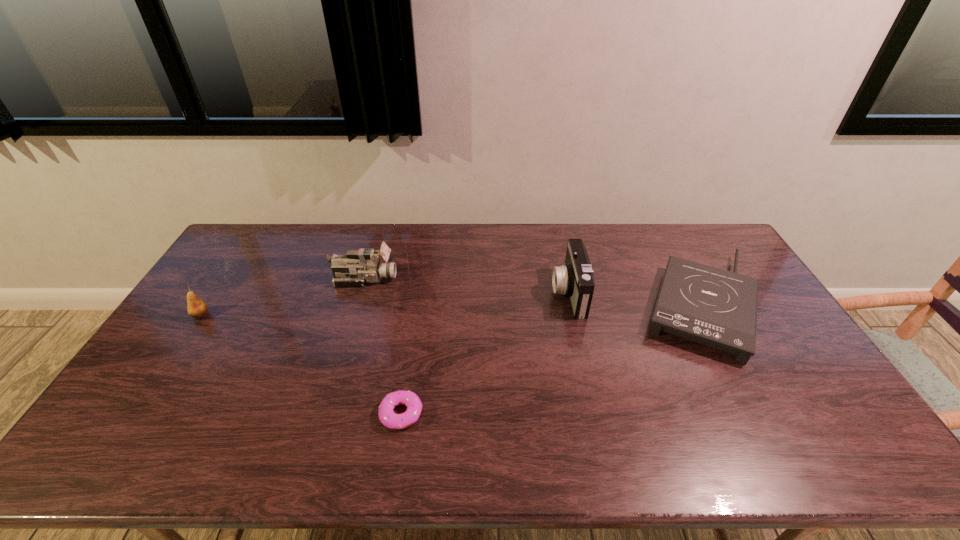
Image resolution: width=960 pixels, height=540 pixels. In order to click on the fourth object from left to right in this screenshot , I will do `click(575, 278)`.

The width and height of the screenshot is (960, 540). Identify the location of the left camcorder. (360, 266).

This screenshot has height=540, width=960. I want to click on the third tallest object, so click(x=196, y=308).

Image resolution: width=960 pixels, height=540 pixels. Find the location of `the leftmost object`. the leftmost object is located at coordinates (196, 308).

Locate an element on the screen. This screenshot has height=540, width=960. the second shortest object is located at coordinates (717, 308).

Where is `hotplate`? hotplate is located at coordinates (717, 308).

Image resolution: width=960 pixels, height=540 pixels. In order to click on doughnut in this screenshot , I will do `click(387, 416)`.

Identify the location of the third object from left to right. (387, 416).

The height and width of the screenshot is (540, 960). In order to click on free space located 0.400m on the lens of the right camcorder in this screenshot , I will do `click(432, 293)`.

The width and height of the screenshot is (960, 540). I want to click on free spot located 0.250m on the lens of the right camcorder, so click(x=477, y=293).